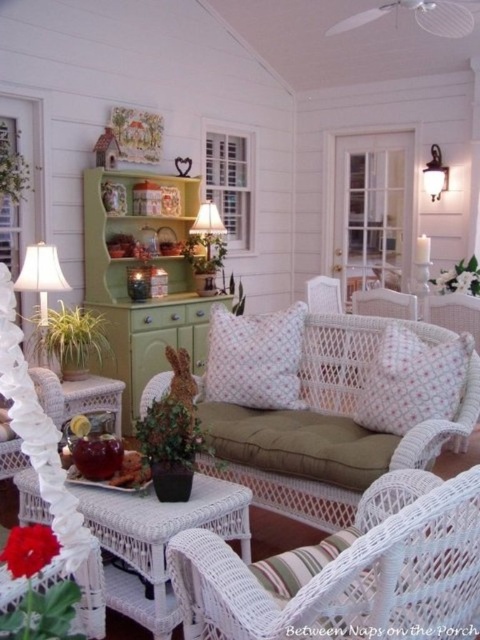
Which of these two, white wicker armchair at lower center or pink dotted fabric pillow at center, stands taller?

With more height is white wicker armchair at lower center.

Which is in front, point (432, 618) or point (364, 403)?

Positioned in front is point (432, 618).

Find the location of `white wicker armchair at lower center`. white wicker armchair at lower center is located at coordinates (348, 579).

Is point (416, 380) positioned before point (284, 342)?

Yes.

Is pink dotted fabric pillow at center below white dotted pillow at center?

Correct, pink dotted fabric pillow at center is located below white dotted pillow at center.

Describe the element at coordinates (412, 380) in the screenshot. This screenshot has height=640, width=480. I see `pink dotted fabric pillow at center` at that location.

Find the location of a particular element. The height and width of the screenshot is (640, 480). pink dotted fabric pillow at center is located at coordinates (412, 380).

Who is lower down, white dotted pillow at center or white wicker armchair at center?

white dotted pillow at center is below.

Is white dotted pillow at center bigger than white wicker armchair at center?

Correct, white dotted pillow at center is larger in size than white wicker armchair at center.

Find the location of a particular element. Image resolution: width=480 pixels, height=640 pixels. white dotted pillow at center is located at coordinates pyautogui.click(x=254, y=358).

The width and height of the screenshot is (480, 640). In order to click on white dotted pillow at center in this screenshot , I will do (x=254, y=358).